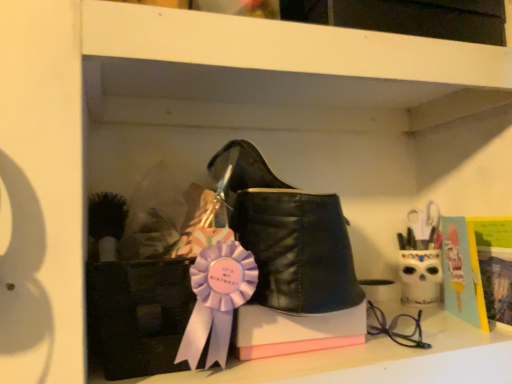
In order to click on vacant space situated on the left part of matte black glasses at lower right in this screenshot , I will do `click(300, 355)`.